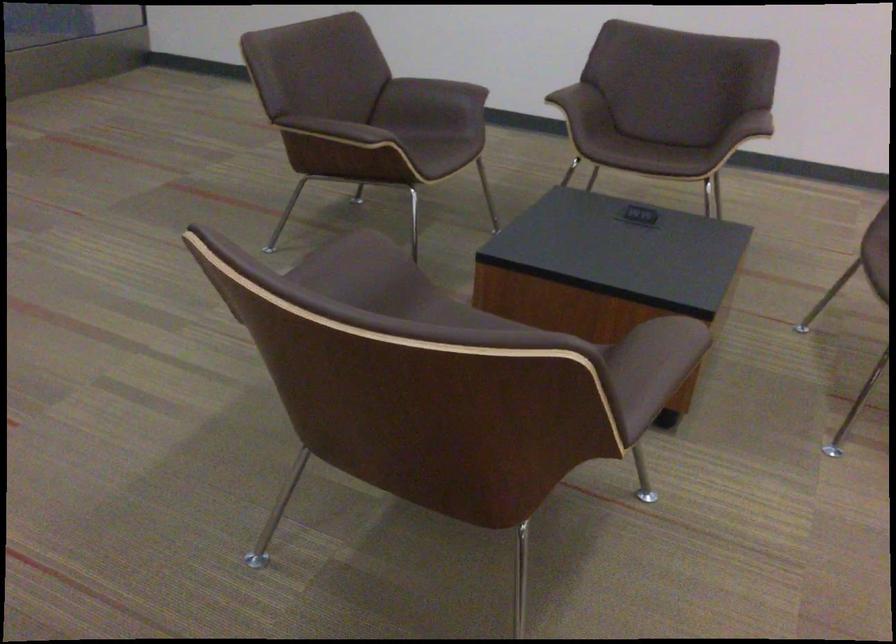
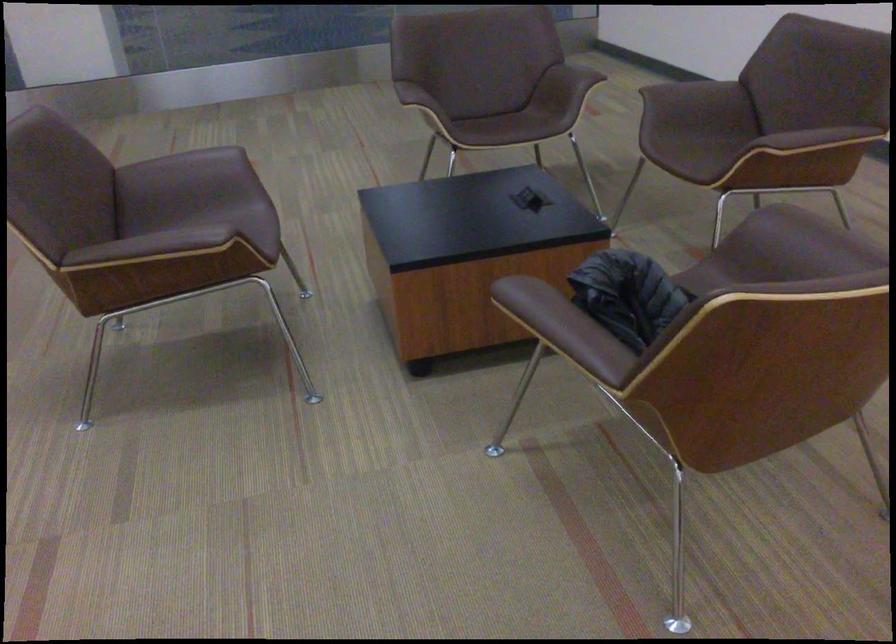
Where in the second image is the point corresponding to point 662,346 from the first image?

(174, 242)